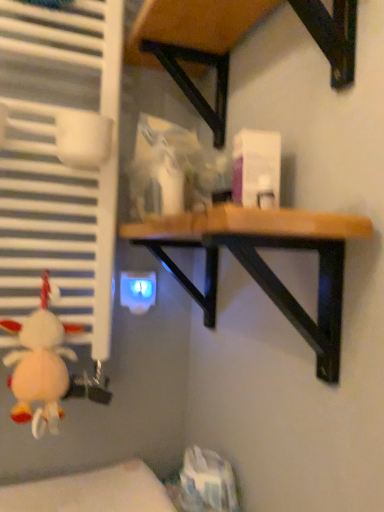
This screenshot has width=384, height=512. What do you see at coordinates (264, 262) in the screenshot?
I see `wooden table at center, which is the second table in top-to-bottom order` at bounding box center [264, 262].

You are a GUI agent. You are given a task and a screenshot of the screen. Output one action in this format:
    pyautogui.click(x=<x>, y=<y>)
    Task: Click on the wooden table at upper center, placed as the 1th table when sorted from top to bottom
    This screenshot has height=512, width=384.
    Given the screenshot: What is the action you would take?
    pyautogui.click(x=194, y=45)

The height and width of the screenshot is (512, 384). What are the coordinates of `fluffy white plush at lower left` in the screenshot? It's located at (40, 365).

From the image's perspective, is wooden table at upper center, which is the 2th table in bottom-to-top order, above or below blue glossy electric outlet at lower center?

wooden table at upper center, which is the 2th table in bottom-to-top order, is situated higher than blue glossy electric outlet at lower center in the image.

Does point (218, 34) appear closer or farther from the camera than point (141, 276)?

Point (218, 34).

Based on their sizes in the image, would you say wooden table at upper center, placed as the 1th table when sorted from top to bottom, is bigger or smaller than blue glossy electric outlet at lower center?

In the image, wooden table at upper center, placed as the 1th table when sorted from top to bottom, appears to be larger than blue glossy electric outlet at lower center.

Can we say wooden table at upper center, placed as the 1th table when sorted from top to bottom, lies outside blue glossy electric outlet at lower center?

Yes, wooden table at upper center, placed as the 1th table when sorted from top to bottom, is not within blue glossy electric outlet at lower center.

Based on the photo, is wooden table at center, which is the first table in bottom-to-top order, wider or thinner than blue glossy electric outlet at lower center?

Considering their sizes, wooden table at center, which is the first table in bottom-to-top order, looks broader than blue glossy electric outlet at lower center.

In the scene shown: Is wooden table at center, which is the first table in bottom-to-top order, positioned with its back to blue glossy electric outlet at lower center?

No, wooden table at center, which is the first table in bottom-to-top order, is not facing the opposite direction of blue glossy electric outlet at lower center.

What's the angular difference between wooden table at center, which is the second table in top-to-bottom order, and blue glossy electric outlet at lower center's facing directions?

91.3 degrees.

Measure the distance from wooden table at center, which is the second table in top-to-bottom order, to blue glossy electric outlet at lower center.

wooden table at center, which is the second table in top-to-bottom order, is 34.10 centimeters away from blue glossy electric outlet at lower center.

Is wooden table at upper center, placed as the 1th table when sorted from top to bottom, far away from wooden table at center, which is the second table in top-to-bottom order?

No.

Could you tell me if wooden table at upper center, placed as the 1th table when sorted from top to bottom, is facing wooden table at center, which is the first table in bottom-to-top order?

No, wooden table at upper center, placed as the 1th table when sorted from top to bottom, is not aimed at wooden table at center, which is the first table in bottom-to-top order.

What's the angular difference between wooden table at upper center, placed as the 1th table when sorted from top to bottom, and wooden table at center, which is the second table in top-to-bottom order,'s facing directions?

The angle between the facing direction of wooden table at upper center, placed as the 1th table when sorted from top to bottom, and the facing direction of wooden table at center, which is the second table in top-to-bottom order, is 1.4e-05 degrees.

Who is more distant, wooden table at upper center, placed as the 1th table when sorted from top to bottom, or wooden table at center, which is the second table in top-to-bottom order?

wooden table at center, which is the second table in top-to-bottom order, is more distant.

Is fluffy white plush at lower left inside the boundaries of wooden table at center, which is the second table in top-to-bottom order, or outside?

fluffy white plush at lower left is located beyond the bounds of wooden table at center, which is the second table in top-to-bottom order.

From a real-world perspective, is fluffy white plush at lower left physically below wooden table at center, which is the first table in bottom-to-top order?

Yes.

Does fluffy white plush at lower left have a smaller size compared to wooden table at center, which is the second table in top-to-bottom order?

Indeed, fluffy white plush at lower left has a smaller size compared to wooden table at center, which is the second table in top-to-bottom order.

Looking at this image, is wooden table at upper center, which is the 2th table in bottom-to-top order, facing towards fluffy white plush at lower left?

No, wooden table at upper center, which is the 2th table in bottom-to-top order, is not aimed at fluffy white plush at lower left.

Where is `toy that appears below the wooden table at upper center, which is the 2th table in bottom-to-top order (from a real-world perspective)`? toy that appears below the wooden table at upper center, which is the 2th table in bottom-to-top order (from a real-world perspective) is located at coordinates (40, 365).

Is wooden table at upper center, which is the 2th table in bottom-to-top order, wider than fluffy white plush at lower left?

Yes.

Consider the image. Is wooden table at upper center, placed as the 1th table when sorted from top to bottom, inside the boundaries of fluffy white plush at lower left, or outside?

wooden table at upper center, placed as the 1th table when sorted from top to bottom, is not inside fluffy white plush at lower left, it's outside.

From a real-world perspective, which is physically above, wooden table at center, which is the first table in bottom-to-top order, or fluffy white plush at lower left?

In real-world perspective, wooden table at center, which is the first table in bottom-to-top order, is above.

Which object is more forward, wooden table at center, which is the first table in bottom-to-top order, or fluffy white plush at lower left?

wooden table at center, which is the first table in bottom-to-top order, is closer to the camera.

From the image's perspective, is wooden table at center, which is the first table in bottom-to-top order, above or below fluffy white plush at lower left?

From the image's perspective, wooden table at center, which is the first table in bottom-to-top order, appears above fluffy white plush at lower left.

Who is taller, wooden table at center, which is the second table in top-to-bottom order, or fluffy white plush at lower left?

fluffy white plush at lower left is taller.

Considering the sizes of fluffy white plush at lower left and wooden table at upper center, placed as the 1th table when sorted from top to bottom, in the image, is fluffy white plush at lower left wider or thinner than wooden table at upper center, placed as the 1th table when sorted from top to bottom,?

In the image, fluffy white plush at lower left appears to be more narrow than wooden table at upper center, placed as the 1th table when sorted from top to bottom.

Find the location of a particular element. This screenshot has height=512, width=384. toy behind the wooden table at upper center, which is the 2th table in bottom-to-top order is located at coordinates (40, 365).

Does point (51, 334) come closer to viewer compared to point (141, 52)?

That is True.

Does fluffy white plush at lower left come in front of wooden table at upper center, which is the 2th table in bottom-to-top order?

No, fluffy white plush at lower left is behind wooden table at upper center, which is the 2th table in bottom-to-top order.

From a real-world perspective, count 2nd tables upward from the blue glossy electric outlet at lower center and point to it. Please provide its 2D coordinates.

[(194, 45)]

Find the location of a particular element. the 1st table in front of the blue glossy electric outlet at lower center, counting from the anchor's position is located at coordinates (264, 262).

Considering their positions, is fluffy white plush at lower left positioned further to wooden table at upper center, which is the 2th table in bottom-to-top order, than wooden table at center, which is the first table in bottom-to-top order?

fluffy white plush at lower left is further to wooden table at upper center, which is the 2th table in bottom-to-top order.

Estimate the real-world distances between objects in this image. Which object is closer to wooden table at upper center, placed as the 1th table when sorted from top to bottom, blue glossy electric outlet at lower center or wooden table at center, which is the first table in bottom-to-top order?

Among the two, wooden table at center, which is the first table in bottom-to-top order, is located nearer to wooden table at upper center, placed as the 1th table when sorted from top to bottom.

Which object lies further to the anchor point wooden table at center, which is the second table in top-to-bottom order, wooden table at upper center, placed as the 1th table when sorted from top to bottom, or blue glossy electric outlet at lower center?

blue glossy electric outlet at lower center is further to wooden table at center, which is the second table in top-to-bottom order.

From the image, which object appears to be farther from blue glossy electric outlet at lower center, fluffy white plush at lower left or wooden table at upper center, placed as the 1th table when sorted from top to bottom?

Based on the image, wooden table at upper center, placed as the 1th table when sorted from top to bottom, appears to be further to blue glossy electric outlet at lower center.

Looking at the image, which one is located closer to wooden table at upper center, placed as the 1th table when sorted from top to bottom, wooden table at center, which is the second table in top-to-bottom order, or blue glossy electric outlet at lower center?

wooden table at center, which is the second table in top-to-bottom order, is positioned closer to the anchor wooden table at upper center, placed as the 1th table when sorted from top to bottom.

Consider the image. Which object lies nearer to the anchor point fluffy white plush at lower left, blue glossy electric outlet at lower center or wooden table at upper center, placed as the 1th table when sorted from top to bottom?

blue glossy electric outlet at lower center.

Estimate the real-world distances between objects in this image. Which object is further from fluffy white plush at lower left, wooden table at center, which is the first table in bottom-to-top order, or wooden table at upper center, placed as the 1th table when sorted from top to bottom?

wooden table at upper center, placed as the 1th table when sorted from top to bottom.

Considering their positions, is wooden table at center, which is the first table in bottom-to-top order, positioned further to blue glossy electric outlet at lower center than fluffy white plush at lower left?

The object further to blue glossy electric outlet at lower center is wooden table at center, which is the first table in bottom-to-top order.

This screenshot has width=384, height=512. Identify the location of electric outlet between wooden table at upper center, which is the 2th table in bottom-to-top order, and fluffy white plush at lower left in the up-down direction. (137, 291).

I want to click on table between wooden table at upper center, which is the 2th table in bottom-to-top order, and fluffy white plush at lower left, in the vertical direction, so click(264, 262).

Locate an element on the screen. The image size is (384, 512). toy between wooden table at center, which is the first table in bottom-to-top order, and blue glossy electric outlet at lower center in the front-back direction is located at coordinates (40, 365).

The image size is (384, 512). I want to click on table between wooden table at upper center, which is the 2th table in bottom-to-top order, and blue glossy electric outlet at lower center, along the z-axis, so click(x=264, y=262).